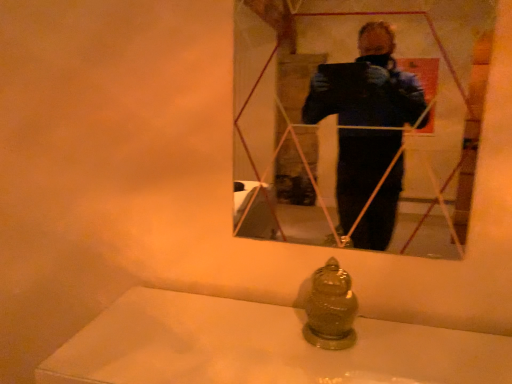
Where is `matte ceramic bath at lower center`? matte ceramic bath at lower center is located at coordinates (261, 347).

The width and height of the screenshot is (512, 384). Describe the element at coordinates (261, 347) in the screenshot. I see `matte ceramic bath at lower center` at that location.

What is the approximate height of matte ceramic bath at lower center?

The height of matte ceramic bath at lower center is 14.30 inches.

Measure the distance between point (176, 294) and camera.

4.15 feet.

Image resolution: width=512 pixels, height=384 pixels. Describe the element at coordinates (356, 115) in the screenshot. I see `matte glass mirror at upper center` at that location.

Identify the location of matte glass mirror at upper center. The height and width of the screenshot is (384, 512). (356, 115).

Where is `matte ceramic bath at lower center`? Image resolution: width=512 pixels, height=384 pixels. matte ceramic bath at lower center is located at coordinates (261, 347).

Considering the relative positions of matte glass mirror at upper center and matte ceramic bath at lower center in the image provided, is matte glass mirror at upper center to the left of matte ceramic bath at lower center from the viewer's perspective?

In fact, matte glass mirror at upper center is to the right of matte ceramic bath at lower center.

Considering their positions, is matte glass mirror at upper center located in front of or behind matte ceramic bath at lower center?

In the image, matte glass mirror at upper center appears behind matte ceramic bath at lower center.

Considering the positions of point (306, 198) and point (212, 303), is point (306, 198) closer or farther from the camera than point (212, 303)?

Point (306, 198) is positioned farther from the camera compared to point (212, 303).

From the image's perspective, is matte glass mirror at upper center located above or below matte ceramic bath at lower center?

matte glass mirror at upper center is above matte ceramic bath at lower center.

From a real-world perspective, is matte glass mirror at upper center positioned above or below matte ceramic bath at lower center?

Clearly, from a real-world perspective, matte glass mirror at upper center is above matte ceramic bath at lower center.

Does matte glass mirror at upper center have a lesser width compared to matte ceramic bath at lower center?

Correct, the width of matte glass mirror at upper center is less than that of matte ceramic bath at lower center.

Who is taller, matte glass mirror at upper center or matte ceramic bath at lower center?

matte glass mirror at upper center is taller.

Is matte glass mirror at upper center bigger than matte ceramic bath at lower center?

No, matte glass mirror at upper center is not bigger than matte ceramic bath at lower center.

Is matte glass mirror at upper center completely or partially outside of matte ceramic bath at lower center?

Yes, matte glass mirror at upper center is not within matte ceramic bath at lower center.

From the picture: Would you consider matte glass mirror at upper center to be distant from matte ceramic bath at lower center?

Yes, matte glass mirror at upper center is far from matte ceramic bath at lower center.

Could you tell me if matte glass mirror at upper center is facing matte ceramic bath at lower center?

No, matte glass mirror at upper center is not turned towards matte ceramic bath at lower center.

What's the angular difference between matte glass mirror at upper center and matte ceramic bath at lower center's facing directions?

0.695 degrees.

The width and height of the screenshot is (512, 384). What are the coordinates of `bath on the left of matte glass mirror at upper center` in the screenshot? It's located at (261, 347).

Considering the relative positions of matte ceramic bath at lower center and matte glass mirror at upper center in the image provided, is matte ceramic bath at lower center to the right of matte glass mirror at upper center from the viewer's perspective?

Incorrect, matte ceramic bath at lower center is not on the right side of matte glass mirror at upper center.

In the image, is matte ceramic bath at lower center positioned in front of or behind matte glass mirror at upper center?

In the image, matte ceramic bath at lower center appears in front of matte glass mirror at upper center.

Between point (179, 342) and point (392, 127), which one is positioned in front?

Positioned in front is point (179, 342).

From the image's perspective, which one is positioned higher, matte ceramic bath at lower center or matte glass mirror at upper center?

matte glass mirror at upper center appears higher in the image.

From a real-world perspective, is matte ceramic bath at lower center located beneath matte glass mirror at upper center?

Yes, from a real-world perspective, matte ceramic bath at lower center is beneath matte glass mirror at upper center.

Does matte ceramic bath at lower center have a lesser width compared to matte glass mirror at upper center?

No, matte ceramic bath at lower center is not thinner than matte glass mirror at upper center.

Is matte ceramic bath at lower center taller than matte glass mirror at upper center?

No.

Does matte ceramic bath at lower center have a larger size compared to matte glass mirror at upper center?

Correct, matte ceramic bath at lower center is larger in size than matte glass mirror at upper center.

Is matte glass mirror at upper center located within matte ceramic bath at lower center?

Definitely not — matte glass mirror at upper center is not inside matte ceramic bath at lower center.

Looking at this image, is matte ceramic bath at lower center not near matte glass mirror at upper center?

Yes, matte ceramic bath at lower center and matte glass mirror at upper center are located far from each other.

Is matte ceramic bath at lower center looking in the opposite direction of matte glass mirror at upper center?

No, matte ceramic bath at lower center's orientation is not away from matte glass mirror at upper center.

Can you tell me how much matte ceramic bath at lower center and matte glass mirror at upper center differ in facing direction?

0.695 degrees.

This screenshot has height=384, width=512. I want to click on bath in front of the matte glass mirror at upper center, so click(261, 347).

This screenshot has width=512, height=384. Find the location of `mirror that appears above the matte ceramic bath at lower center (from the image's perspective)`. mirror that appears above the matte ceramic bath at lower center (from the image's perspective) is located at coordinates (356, 115).

Identify the location of bath that is under the matte glass mirror at upper center (from a real-world perspective). (261, 347).